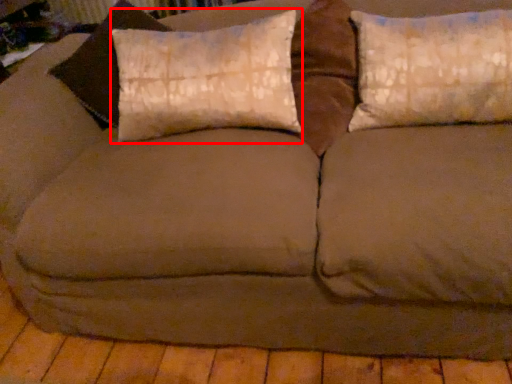
Question: From the image, what is the correct spatial relationship of pillow (annotated by the red box) in relation to pillow?

Choices:
 (A) left
 (B) right

Answer: (A)